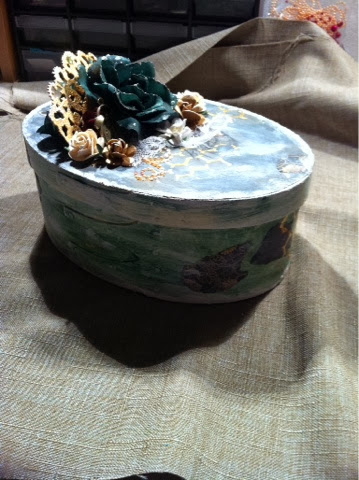
Locate an element on the screen. This screenshot has height=480, width=359. box is located at coordinates (240, 192).